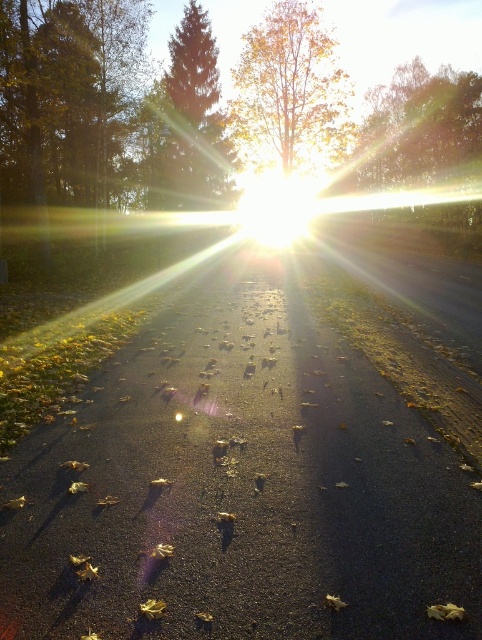
Question: Which point is farther to the camera?

Choices:
 (A) green leafy tree at upper center
 (B) yellow/golden leaves at upper center
 (C) green matte tree at upper center

Answer: (B)

Question: Which point appears farthest from the camera in this image?

Choices:
 (A) (419, 157)
 (B) (209, 160)
 (C) (244, 129)

Answer: (C)

Question: Does yellow/golden leaves at upper center appear on the left side of green matte tree at upper center?

Choices:
 (A) no
 (B) yes

Answer: (A)

Question: Can you confirm if yellow/golden leaves at upper center is smaller than green matte tree at upper center?

Choices:
 (A) no
 (B) yes

Answer: (A)

Question: Can you confirm if green leafy tree at upper center is smaller than green matte tree at upper center?

Choices:
 (A) yes
 (B) no

Answer: (B)

Question: Which object is positioned closest to the green leafy tree at upper center?

Choices:
 (A) green matte tree at upper center
 (B) yellow/golden leaves at upper center

Answer: (B)